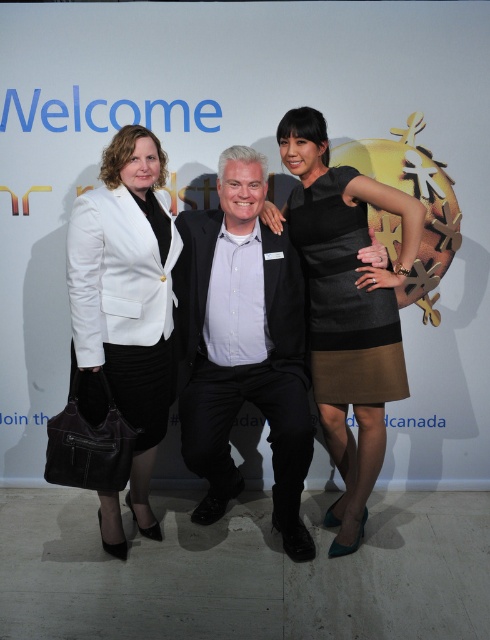
You are standing in front of the backdrop and want to move from the point marked at coordinate (337, 221) to the point marked at coordinate (116, 378). Which direction should you move to get closer to the latter?

To move from point (337, 221) to point (116, 378), you should move towards the right and downward since the target point is located to the right and below the starting point.

From the picture: You are a photographer trying to decide where to place a new subject in this group photo. The new subject will wear a black satin dress at center. You need to ensure there is enough space between them and the existing black cotton suit at center. Based on the current arrangement, is the existing space between the two sufficient for the new subject?

The black cotton suit at center is thinner than the black satin dress at center, so the existing space between them may be sufficient as the thinner suit takes up less width, allowing more space for the new subject in the black satin dress at center.